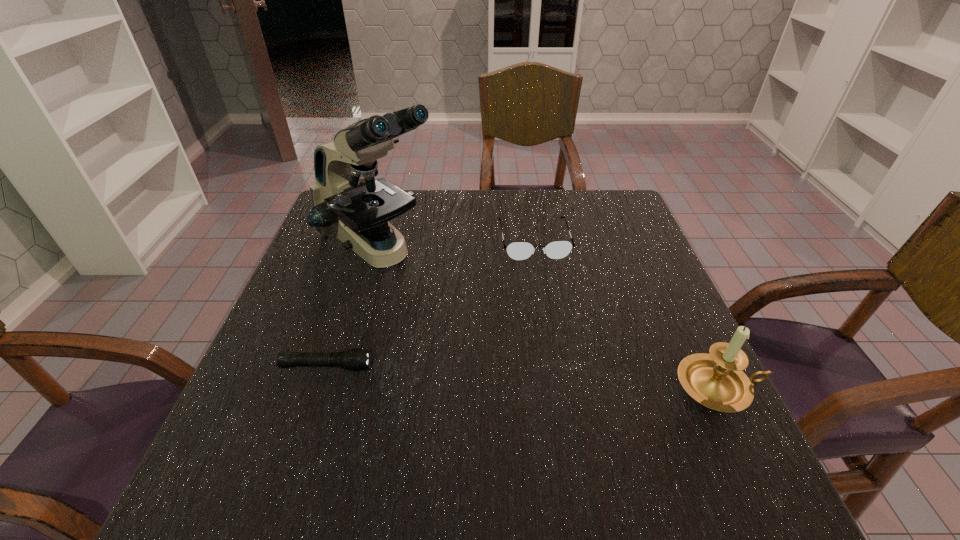
The height and width of the screenshot is (540, 960). In order to click on the shortest object in this screenshot , I will do `click(355, 359)`.

This screenshot has height=540, width=960. In order to click on candle holder in this screenshot , I will do `click(716, 380)`.

Find the location of a particular element. the third shortest object is located at coordinates (716, 380).

Find the location of a particular element. Image resolution: width=960 pixels, height=540 pixels. the second shortest object is located at coordinates [x=519, y=251].

Where is `the third object from left to right`? The image size is (960, 540). the third object from left to right is located at coordinates (519, 251).

Identify the location of the tallest object. (347, 201).

Where is `vacant space located at the lens end of the flashlight`? This screenshot has height=540, width=960. vacant space located at the lens end of the flashlight is located at coordinates tap(427, 366).

The width and height of the screenshot is (960, 540). In order to click on free space located 0.210m on the lenses of the spectacles in this screenshot , I will do `click(552, 321)`.

At what (x,y) coordinates should I click in order to perform the action: click on vacant space situated on the lenses of the spectacles. Please return your answer as a coordinate pair (x, y). This screenshot has width=960, height=540. Looking at the image, I should click on (563, 364).

The image size is (960, 540). Find the location of `vacant area situated 0.250m on the lenses of the spectacles`. vacant area situated 0.250m on the lenses of the spectacles is located at coordinates (556, 334).